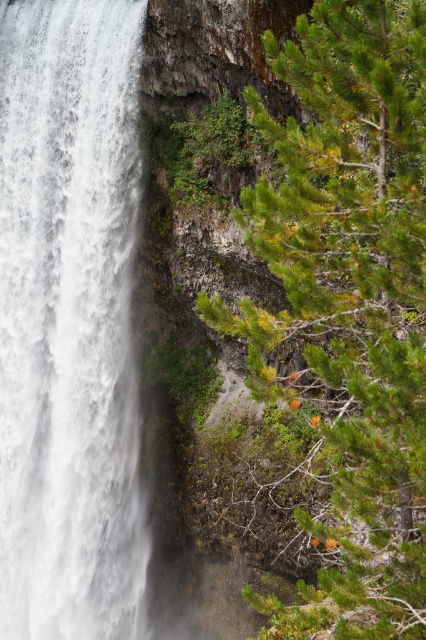
You are standing at the base of the waterfall and want to take a photo of the green needle leaf tree at right. Where should you position yourself to capture the tree at point (348, 305)?

You should position yourself at the base of the waterfall and aim your camera towards the green needle leaf tree at right located at point (348, 305) to capture it in the frame.